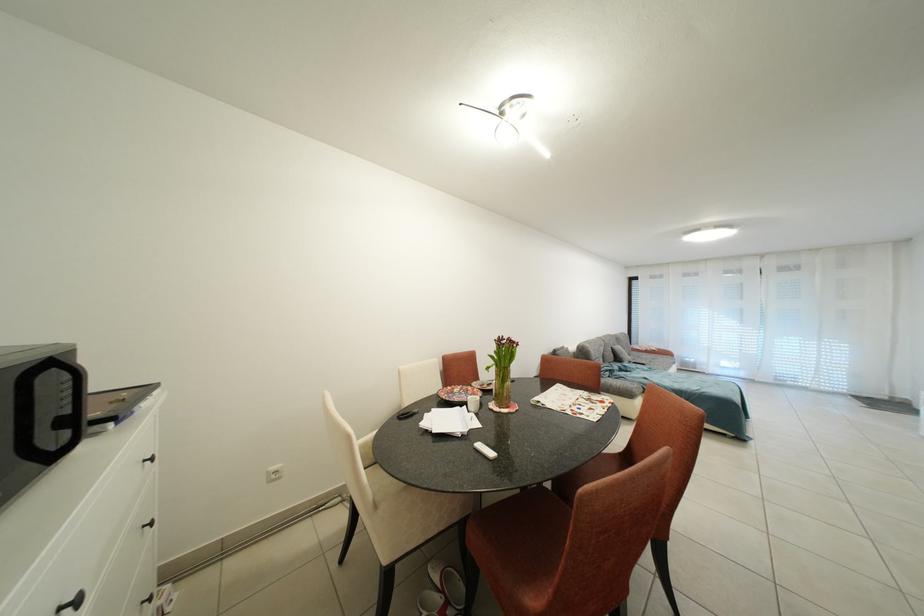
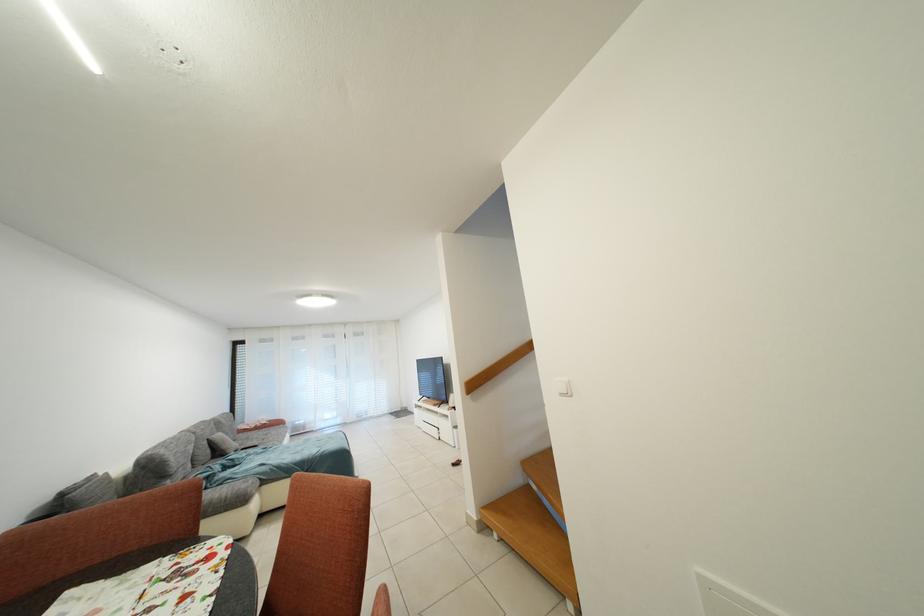
In the second image, find the point that corresponds to pixel 626 352 in the first image.

(227, 440)